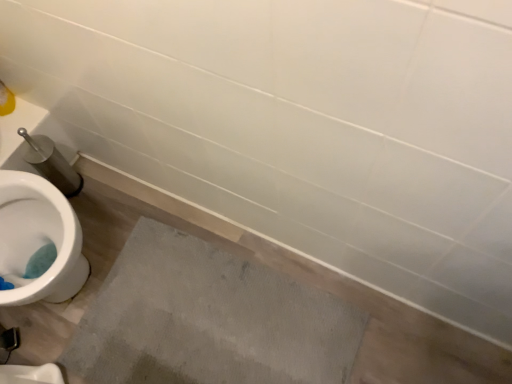
Image resolution: width=512 pixels, height=384 pixels. What do you see at coordinates (208, 320) in the screenshot?
I see `gray textured concrete at lower center` at bounding box center [208, 320].

Where is `gray textured concrete at lower center`? The height and width of the screenshot is (384, 512). gray textured concrete at lower center is located at coordinates (208, 320).

This screenshot has width=512, height=384. In order to click on gray textured concrete at lower center in this screenshot , I will do `click(208, 320)`.